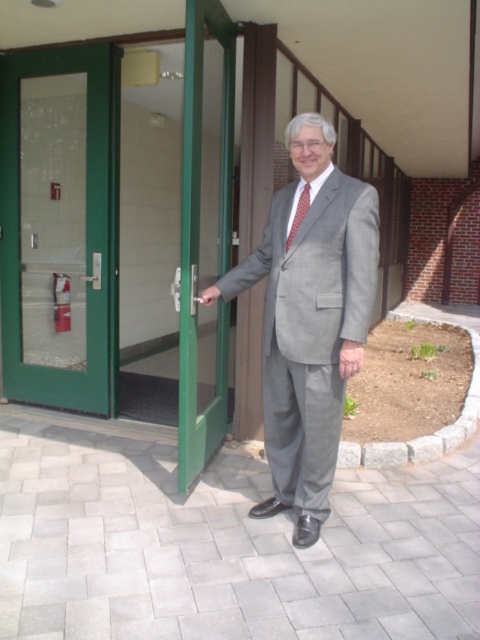
Can you confirm if green glass door at left is smaller than red dotted tie at center?

No.

Identify the location of green glass door at left. (60, 225).

Image resolution: width=480 pixels, height=640 pixels. In order to click on green glass door at left in this screenshot , I will do `click(60, 225)`.

Does green glass door at left appear under green glass door at center?

No.

Is green glass door at left to the right of green glass door at center from the viewer's perspective?

Incorrect, green glass door at left is not on the right side of green glass door at center.

Is point (90, 77) positioned after point (211, 305)?

Yes, it is behind point (211, 305).

Where is `green glass door at left`? The height and width of the screenshot is (640, 480). green glass door at left is located at coordinates (60, 225).

Looking at this image, does gray wool suit at center lie behind green glass door at center?

That is False.

Can you confirm if gray wool suit at center is smaller than green glass door at center?

Indeed, gray wool suit at center has a smaller size compared to green glass door at center.

Find the location of a particular element. This screenshot has height=640, width=480. gray wool suit at center is located at coordinates (310, 320).